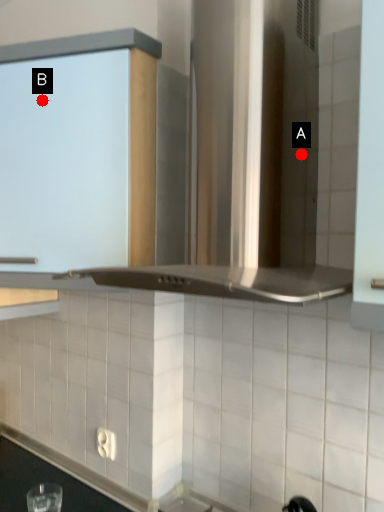
Question: Two points are circled on the image, labeled by A and B beside each circle. Which point is closer to the camera taking this photo?

Choices:
 (A) A is closer
 (B) B is closer

Answer: (A)